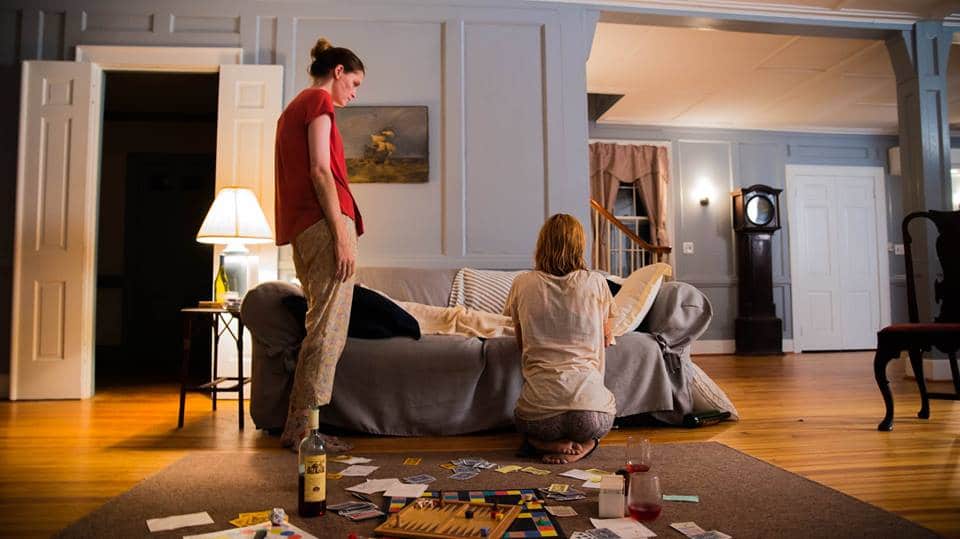
This screenshot has height=539, width=960. In order to click on lamp in this screenshot , I will do `click(228, 220)`.